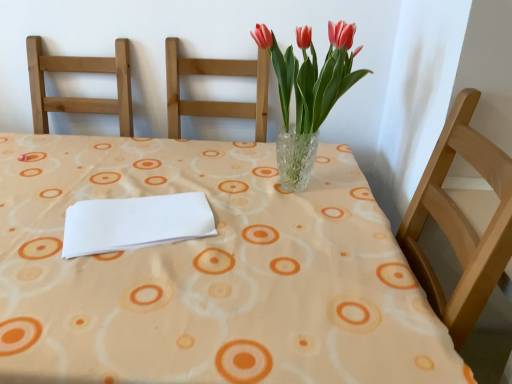
Question: From a real-world perspective, relative to clear glass vase at center, is translucent glass vase at center vertically above or below?

Choices:
 (A) below
 (B) above

Answer: (B)

Question: From the image's perspective, is translucent glass vase at center above or below clear glass vase at center?

Choices:
 (A) below
 (B) above

Answer: (B)

Question: Which of these objects is positioned farthest from the translucent glass vase at center?

Choices:
 (A) white paper at center
 (B) clear glass vase at center

Answer: (A)

Question: Which is farther from the white paper at center?

Choices:
 (A) translucent glass vase at center
 (B) clear glass vase at center

Answer: (A)